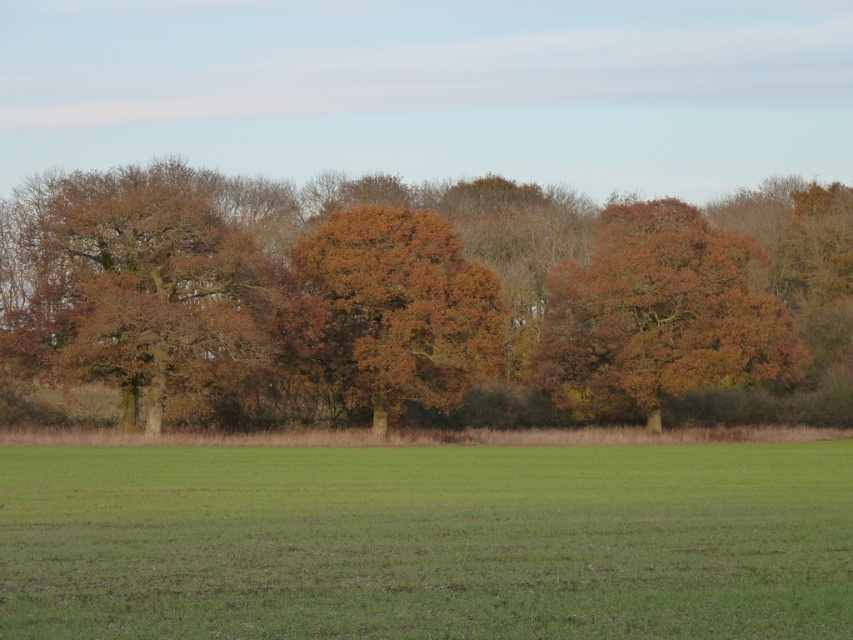
Question: Which object is closer to the camera taking this photo?

Choices:
 (A) brown matte tree at center
 (B) brown matte tree at center-right
 (C) brown matte tree at left

Answer: (C)

Question: Which object is farther from the camera taking this photo?

Choices:
 (A) brown textured trees at center
 (B) brown matte tree at center-right
 (C) brown matte tree at center
 (D) brown matte tree at left

Answer: (B)

Question: Can you confirm if brown textured trees at center is smaller than brown matte tree at left?

Choices:
 (A) no
 (B) yes

Answer: (A)

Question: Is brown textured trees at center to the right of brown matte tree at left from the viewer's perspective?

Choices:
 (A) yes
 (B) no

Answer: (A)

Question: Can you confirm if green grass at center is positioned below brown matte tree at left?

Choices:
 (A) yes
 (B) no

Answer: (A)

Question: Which object is closer to the camera taking this photo?

Choices:
 (A) brown matte tree at center-right
 (B) brown textured trees at center

Answer: (B)